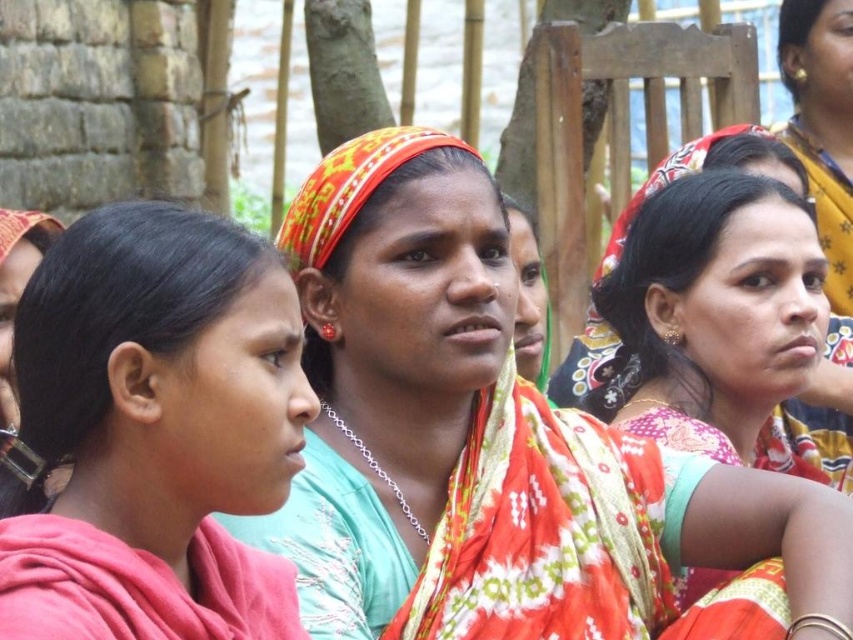
Does point (352, 428) come behind point (100, 616)?

Yes, point (352, 428) is behind point (100, 616).

Is red and white patterned sari at center smaller than pink fabric headscarf at center?

No, red and white patterned sari at center is not smaller than pink fabric headscarf at center.

Who is more distant from viewer, (413,465) or (177,397)?

Positioned behind is point (413,465).

Find the location of a particular element. The width and height of the screenshot is (853, 640). red and white patterned sari at center is located at coordinates (444, 426).

Is red and white patterned sari at center taller than red woven cloth at center?

Correct, red and white patterned sari at center is much taller as red woven cloth at center.

Which is above, red and white patterned sari at center or red woven cloth at center?

Positioned higher is red woven cloth at center.

Which is behind, point (422, 256) or point (380, 163)?

Positioned behind is point (422, 256).

This screenshot has width=853, height=640. In order to click on red and white patterned sari at center in this screenshot , I will do `click(444, 426)`.

Between floral silk saree at center and red woven cloth at center, which one has less height?

Standing shorter between the two is red woven cloth at center.

Can you confirm if floral silk saree at center is shorter than red woven cloth at center?

Incorrect, floral silk saree at center's height does not fall short of red woven cloth at center's.

Which is behind, point (694, 435) or point (311, 260)?

The point (694, 435) is more distant.

Locate an element on the screen. This screenshot has height=640, width=853. floral silk saree at center is located at coordinates [712, 312].